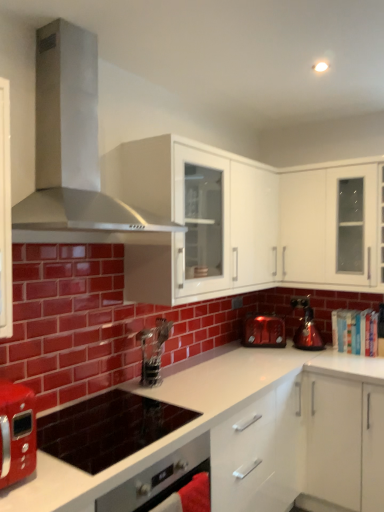
Question: Is matte red toaster at center, placed as the 2th kitchen appliance when sorted from right to left, at the right side of white glossy countertop at center?

Choices:
 (A) no
 (B) yes

Answer: (B)

Question: Is matte red toaster at center, placed as the 2th kitchen appliance when sorted from right to left, oriented away from white glossy countertop at center?

Choices:
 (A) yes
 (B) no

Answer: (B)

Question: Is matte red toaster at center, which is the first kitchen appliance from left to right, outside white glossy countertop at center?

Choices:
 (A) no
 (B) yes

Answer: (B)

Question: Is matte red toaster at center, which is the first kitchen appliance from left to right, at the left side of white glossy countertop at center?

Choices:
 (A) yes
 (B) no

Answer: (B)

Question: From the image's perspective, is matte red toaster at center, which is the first kitchen appliance from left to right, located beneath white glossy countertop at center?

Choices:
 (A) no
 (B) yes

Answer: (A)

Question: From the image's perspective, is metallic silver coffee machine at center positioned above or below matte black cooktop at center?

Choices:
 (A) below
 (B) above

Answer: (B)

Question: Would you say metallic silver coffee machine at center is to the left or to the right of matte black cooktop at center in the picture?

Choices:
 (A) left
 (B) right

Answer: (B)

Question: From a real-world perspective, is metallic silver coffee machine at center physically located above or below matte black cooktop at center?

Choices:
 (A) below
 (B) above

Answer: (B)

Question: Is metallic silver coffee machine at center taller or shorter than matte black cooktop at center?

Choices:
 (A) tall
 (B) short

Answer: (A)

Question: Based on their sizes in the image, would you say shiny metallic kettle at right, the second kitchen appliance from the left, is bigger or smaller than matte red toaster at center, which is the first kitchen appliance from left to right?

Choices:
 (A) small
 (B) big

Answer: (A)

Question: Visually, is shiny metallic kettle at right, positioned as the 1th kitchen appliance in right-to-left order, positioned to the left or to the right of matte red toaster at center, placed as the 2th kitchen appliance when sorted from right to left?

Choices:
 (A) left
 (B) right

Answer: (B)

Question: From a real-world perspective, is shiny metallic kettle at right, the second kitchen appliance from the left, positioned above or below matte red toaster at center, placed as the 2th kitchen appliance when sorted from right to left?

Choices:
 (A) above
 (B) below

Answer: (A)

Question: In terms of height, does shiny metallic kettle at right, the second kitchen appliance from the left, look taller or shorter compared to matte red toaster at center, which is the first kitchen appliance from left to right?

Choices:
 (A) short
 (B) tall

Answer: (B)

Question: Does point (26, 214) appear closer or farther from the camera than point (326, 265)?

Choices:
 (A) farther
 (B) closer

Answer: (B)

Question: From a real-world perspective, is stainless steel range hood at upper left above or below white glossy cabinet at upper right, which appears as the second cabinetry when viewed from the left?

Choices:
 (A) below
 (B) above

Answer: (B)